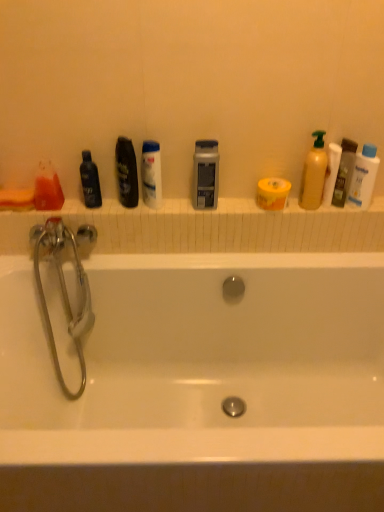
Question: From the image's perspective, is white plastic baby lotion at upper right, the first cleaning product when ordered from right to left, below translucent orange liquid at left, arranged as the first mouthwash when viewed from the left?

Choices:
 (A) yes
 (B) no

Answer: (B)

Question: Is white plastic baby lotion at upper right, acting as the second cleaning product starting from the left, aimed at translucent orange liquid at left, arranged as the first mouthwash when viewed from the left?

Choices:
 (A) no
 (B) yes

Answer: (A)

Question: Is white plastic baby lotion at upper right, acting as the second cleaning product starting from the left, thinner than translucent orange liquid at left, arranged as the first mouthwash when viewed from the left?

Choices:
 (A) no
 (B) yes

Answer: (B)

Question: Considering the relative positions of white plastic baby lotion at upper right, acting as the second cleaning product starting from the left, and translucent orange liquid at left, arranged as the first mouthwash when viewed from the left, in the image provided, is white plastic baby lotion at upper right, acting as the second cleaning product starting from the left, to the right of translucent orange liquid at left, arranged as the first mouthwash when viewed from the left, from the viewer's perspective?

Choices:
 (A) no
 (B) yes

Answer: (B)

Question: From a real-world perspective, is white plastic baby lotion at upper right, acting as the second cleaning product starting from the left, on translucent orange liquid at left, the 6th mouthwash viewed from the right?

Choices:
 (A) yes
 (B) no

Answer: (A)

Question: From the image's perspective, is black matte bottle at center, the 3th mouthwash from the left, positioned above or below translucent plastic mouthwash at right, the first mouthwash in the right-to-left sequence?

Choices:
 (A) below
 (B) above

Answer: (B)

Question: From their relative heights in the image, would you say black matte bottle at center, the 3th mouthwash from the left, is taller or shorter than translucent plastic mouthwash at right, the first mouthwash in the right-to-left sequence?

Choices:
 (A) short
 (B) tall

Answer: (A)

Question: Considering the positions of black matte bottle at center, the 3th mouthwash from the left, and translucent plastic mouthwash at right, acting as the 6th mouthwash starting from the left, in the image, is black matte bottle at center, the 3th mouthwash from the left, bigger or smaller than translucent plastic mouthwash at right, acting as the 6th mouthwash starting from the left,?

Choices:
 (A) small
 (B) big

Answer: (B)

Question: Relative to translucent plastic mouthwash at right, the first mouthwash in the right-to-left sequence, is black matte bottle at center, placed as the 4th mouthwash when sorted from right to left, in front or behind?

Choices:
 (A) front
 (B) behind

Answer: (A)

Question: Relative to white glossy mouthwash at center, which appears as the fourth mouthwash when viewed from the left, is silver metallic faucet at left in front or behind?

Choices:
 (A) front
 (B) behind

Answer: (A)

Question: Which is correct: silver metallic faucet at left is inside white glossy mouthwash at center, which appears as the fourth mouthwash when viewed from the left, or outside of it?

Choices:
 (A) outside
 (B) inside

Answer: (A)

Question: From the image's perspective, is silver metallic faucet at left above or below white glossy mouthwash at center, which appears as the fourth mouthwash when viewed from the left?

Choices:
 (A) above
 (B) below

Answer: (B)

Question: From a real-world perspective, is silver metallic faucet at left positioned above or below white glossy mouthwash at center, which appears as the fourth mouthwash when viewed from the left?

Choices:
 (A) below
 (B) above

Answer: (A)

Question: From the image's perspective, is translucent orange liquid at left, the 6th mouthwash viewed from the right, located above or below white plastic baby lotion at upper right, the first cleaning product when ordered from right to left?

Choices:
 (A) below
 (B) above

Answer: (A)

Question: Would you say translucent orange liquid at left, arranged as the first mouthwash when viewed from the left, is to the left or to the right of white plastic baby lotion at upper right, acting as the second cleaning product starting from the left, in the picture?

Choices:
 (A) left
 (B) right

Answer: (A)